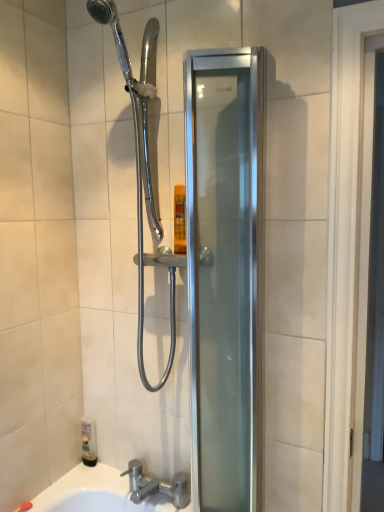
Question: Is silver metallic faucet at lower center spatially inside satin silver glass shower door at center, or outside of it?

Choices:
 (A) inside
 (B) outside

Answer: (B)

Question: Considering the positions of silver metallic faucet at lower center and satin silver glass shower door at center in the image, is silver metallic faucet at lower center taller or shorter than satin silver glass shower door at center?

Choices:
 (A) tall
 (B) short

Answer: (B)

Question: Which is farther from the satin silver glass shower door at center?

Choices:
 (A) silver metallic faucet at lower center
 (B) translucent plastic bottle at lower left

Answer: (B)

Question: Estimate the real-world distances between objects in this image. Which object is closer to the translucent plastic bottle at lower left?

Choices:
 (A) silver metallic faucet at lower center
 (B) satin silver glass shower door at center

Answer: (A)